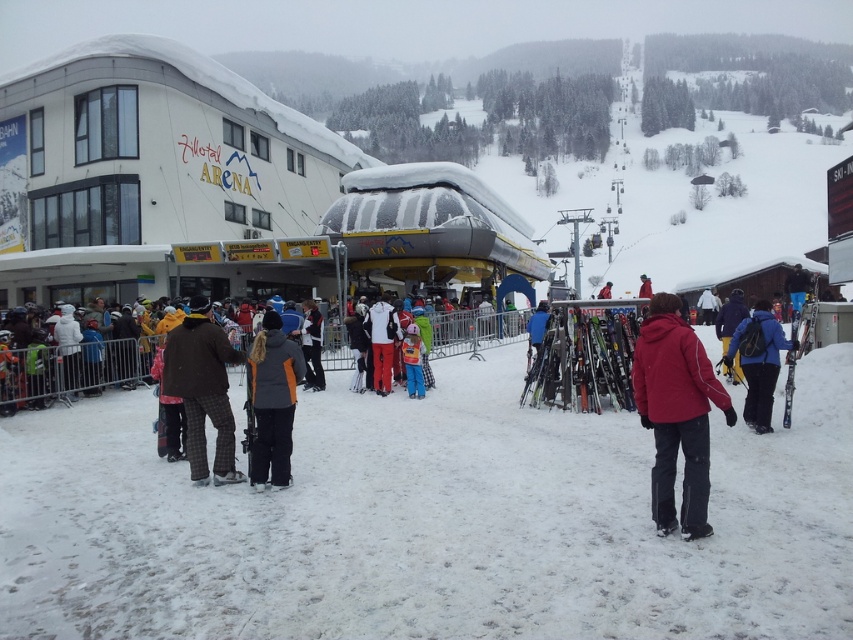
You are standing at the ski lift station and want to move towards the two points marked in the image. Which point, point (762, 371) or point (387, 372), is closer to you?

Point (762, 371) is closer to the viewer than point (387, 372).

You are a photographer standing at the Total Arena ski lift station. You want to take a photo that includes both the white snow ski slope at center and the orange snow pants at center. Which object should you focus on first to ensure both are in the frame?

The white snow ski slope at center is bigger than the orange snow pants at center, so you should focus on the white snow ski slope at center first to ensure both fit in the frame.

Based on the photo, you are a ski equipment inspector checking the width of the skis. According to the image, which of the two skis, the metallic skis at right or the matte black ski at center, is wider?

The metallic skis at right are wider than the matte black ski at center according to the description.